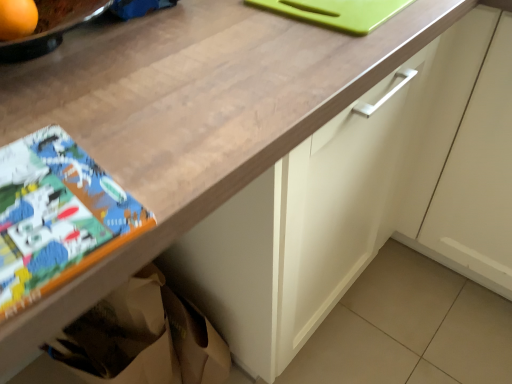
In order to face matte paper comic book at lower left, should I rotate leftwards or rightwards?

Rotate your view left by about 33.487°.

The height and width of the screenshot is (384, 512). I want to click on orange matte at upper left, so click(17, 19).

Would you say white matte cabinet at center is outside matte paper comic book at lower left?

Indeed, white matte cabinet at center is completely outside matte paper comic book at lower left.

Can you tell me how much white matte cabinet at center and matte paper comic book at lower left differ in facing direction?

There is a 85.9-degree angle between the facing directions of white matte cabinet at center and matte paper comic book at lower left.

Is white matte cabinet at center facing away from matte paper comic book at lower left?

No, matte paper comic book at lower left is not at the back of white matte cabinet at center.

From a real-world perspective, between white matte cabinet at center and orange matte at upper left, who is vertically lower?

white matte cabinet at center, from a real-world perspective.

Between white matte cabinet at center and orange matte at upper left, which one has more height?

With more height is white matte cabinet at center.

Considering the positions of objects white matte cabinet at center and orange matte at upper left in the image provided, who is more to the left, white matte cabinet at center or orange matte at upper left?

From the viewer's perspective, orange matte at upper left appears more on the left side.

How many degrees apart are the facing directions of orange matte at upper left and white matte cabinet at center?

90 degrees.

Considering the points (33, 16) and (451, 232), which point is behind, point (33, 16) or point (451, 232)?

The point (451, 232) is more distant.

From the picture: Considering the sizes of objects orange matte at upper left and white matte cabinet at center in the image provided, who is taller, orange matte at upper left or white matte cabinet at center?

Standing taller between the two is white matte cabinet at center.

Is orange matte at upper left beside matte paper comic book at lower left?

No, orange matte at upper left is not beside matte paper comic book at lower left.

From the image's perspective, which object appears higher, orange matte at upper left or matte paper comic book at lower left?

orange matte at upper left.

From a real-world perspective, who is located higher, orange matte at upper left or matte paper comic book at lower left?

orange matte at upper left is physically above.

Is matte paper comic book at lower left to the left of orange matte at upper left from the viewer's perspective?

No.

Considering the sizes of matte paper comic book at lower left and orange matte at upper left in the image, is matte paper comic book at lower left bigger or smaller than orange matte at upper left?

matte paper comic book at lower left is bigger than orange matte at upper left.

At what (x,y) coordinates should I click in order to perform the action: click on orange above the matte paper comic book at lower left (from a real-world perspective). Please return your answer as a coordinate pair (x, y). Looking at the image, I should click on (17, 19).

From the image's perspective, is matte paper comic book at lower left beneath orange matte at upper left?

Indeed, from the image's perspective, matte paper comic book at lower left is shown beneath orange matte at upper left.

Is matte paper comic book at lower left oriented away from white matte cabinet at center?

That's not correct — matte paper comic book at lower left is not looking away from white matte cabinet at center.

From a real-world perspective, relative to white matte cabinet at center, is matte paper comic book at lower left vertically above or below?

Clearly, from a real-world perspective, matte paper comic book at lower left is above white matte cabinet at center.

Does point (57, 253) come farther from viewer compared to point (503, 266)?

No.

Which is behind, matte paper comic book at lower left or white matte cabinet at center?

Positioned behind is white matte cabinet at center.

At what (x,y) coordinates should I click in order to perform the action: click on comic book that is on the left side of white matte cabinet at center. Please return your answer as a coordinate pair (x, y). Looking at the image, I should click on (57, 216).

Find the location of `orange above the white matte cabinet at center (from the image's perspective)`. orange above the white matte cabinet at center (from the image's perspective) is located at coordinates (17, 19).

Estimate the real-world distances between objects in this image. Which object is closer to white matte cabinet at center, matte paper comic book at lower left or orange matte at upper left?

Among the two, matte paper comic book at lower left is located nearer to white matte cabinet at center.

Based on their spatial positions, is white matte cabinet at center or matte paper comic book at lower left further from orange matte at upper left?

white matte cabinet at center is positioned further to the anchor orange matte at upper left.

Looking at the image, which one is located closer to white matte cabinet at center, orange matte at upper left or matte paper comic book at lower left?

matte paper comic book at lower left lies closer to white matte cabinet at center than the other object.

Based on the photo, which object lies nearer to the anchor point orange matte at upper left, matte paper comic book at lower left or white matte cabinet at center?

matte paper comic book at lower left is closer to orange matte at upper left.

Estimate the real-world distances between objects in this image. Which object is closer to matte paper comic book at lower left, white matte cabinet at center or orange matte at upper left?

orange matte at upper left is closer to matte paper comic book at lower left.

In the scene shown: From the image, which object appears to be nearer to matte paper comic book at lower left, orange matte at upper left or white matte cabinet at center?

orange matte at upper left is closer to matte paper comic book at lower left.

The width and height of the screenshot is (512, 384). What are the coordinates of `comic book situated between orange matte at upper left and white matte cabinet at center from left to right` in the screenshot? It's located at (57, 216).